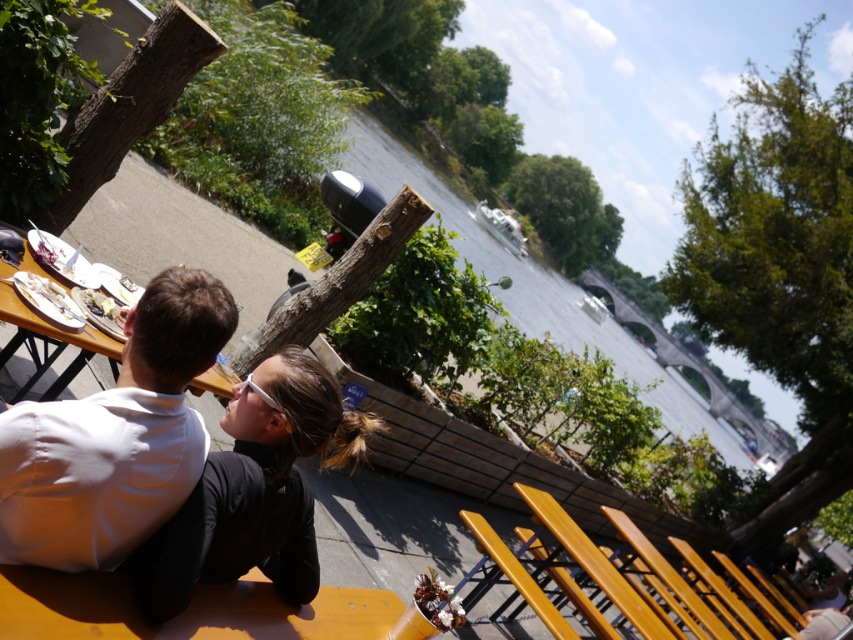
You are a photographer trying to capture a candid shot of the white matte shirt at upper left and the black matte jacket at center. Since you want to focus on both subjects equally, which subject should you zoom in on more to ensure they appear the same size in the photo?

The white matte shirt at upper left occupies less space than the black matte jacket at center, so you should zoom in more on the white matte shirt at upper left to make it appear larger in the photo and balance its size with the black matte jacket at center.

Consider the image. You are a photographer standing at the center of the scene. You want to take a photo of the white matte shirt at upper left. Where should you aim your camera? Please provide coordinates in the format of point 0.0 to 1.0 on both x and y axes, with the origin at the bottom left corner of the image.

You should aim your camera at point 0.684 on the x axis and 0.136 on the y axis to capture the white matte shirt at upper left.